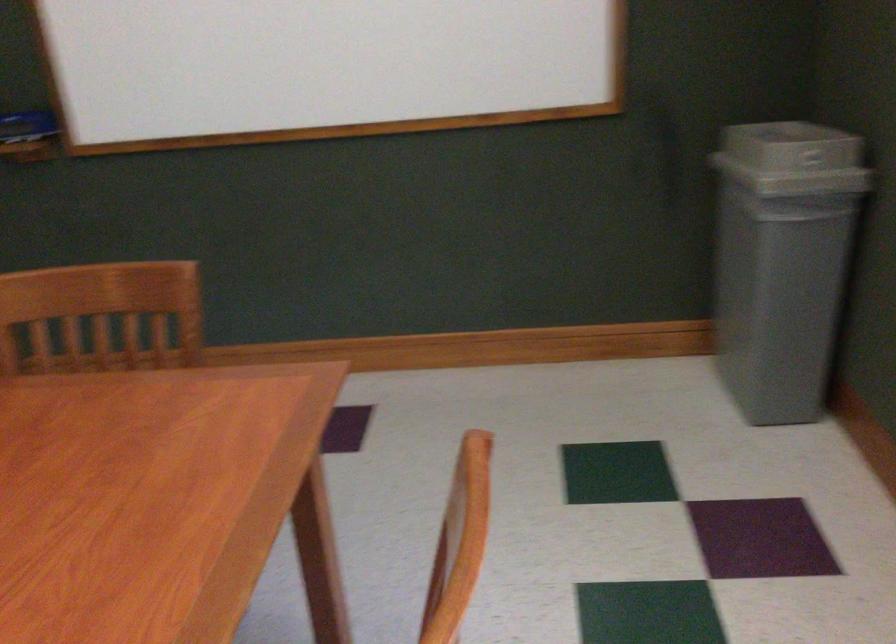
Describe the element at coordinates (793, 167) in the screenshot. I see `the trash can lid` at that location.